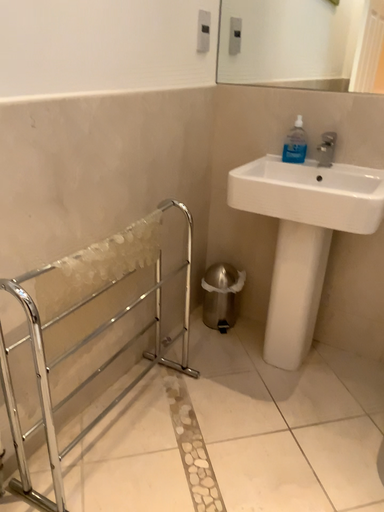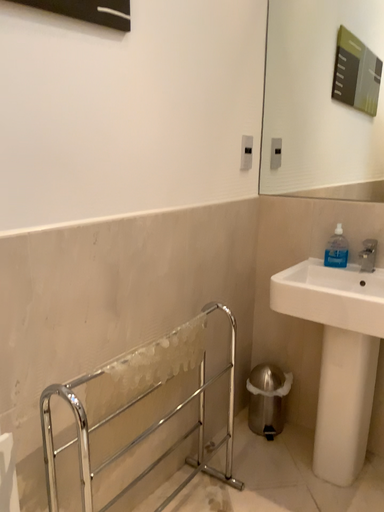
Question: Which way did the camera rotate in the video?

Choices:
 (A) rotated downward
 (B) rotated upward

Answer: (B)